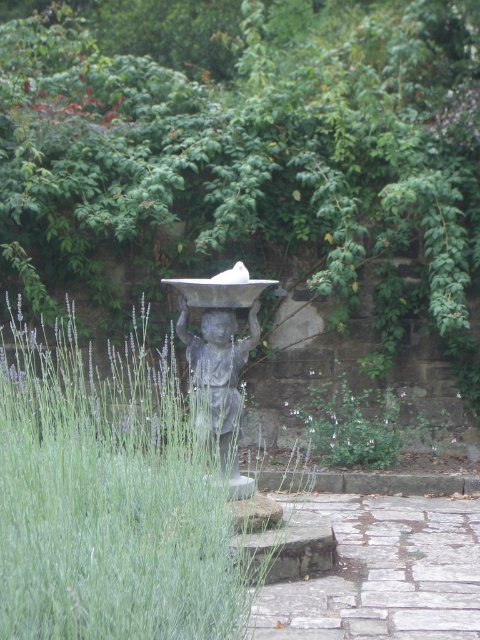
You are standing in the garden looking at the statue. There are two points marked in the image. Which point, point (248, 344) or point (382, 467), is closer to you?

Point (248, 344) is closer to the camera than point (382, 467), so the point closer to you is point (248, 344).

You are standing at the entrance of the garden and see two points marked in the image. The first point is at coordinate point (121, 492) and the second is at point (334, 387). Which point is closer to you as you face the garden?

Point (121, 492) is in front of point (334, 387), so it is closer to you as you face the garden.